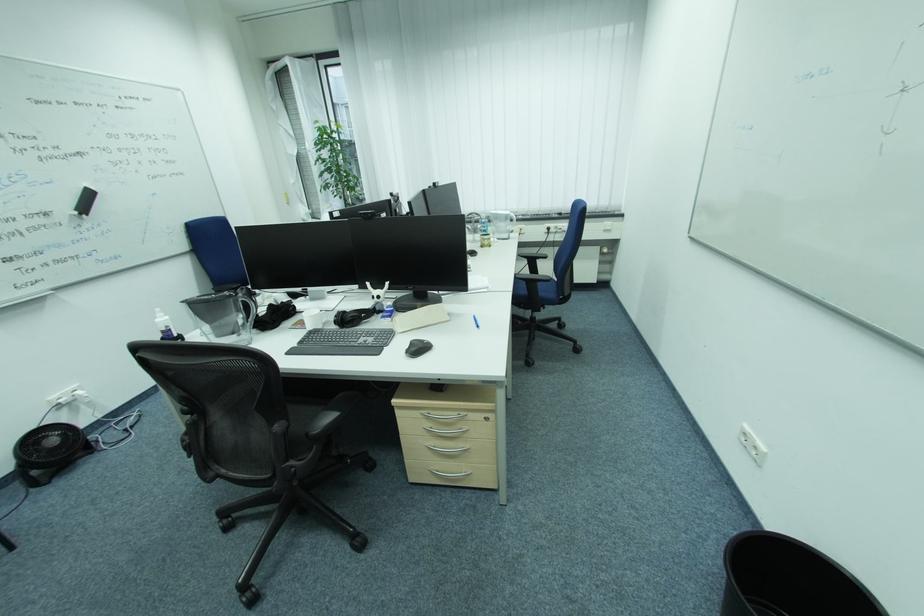
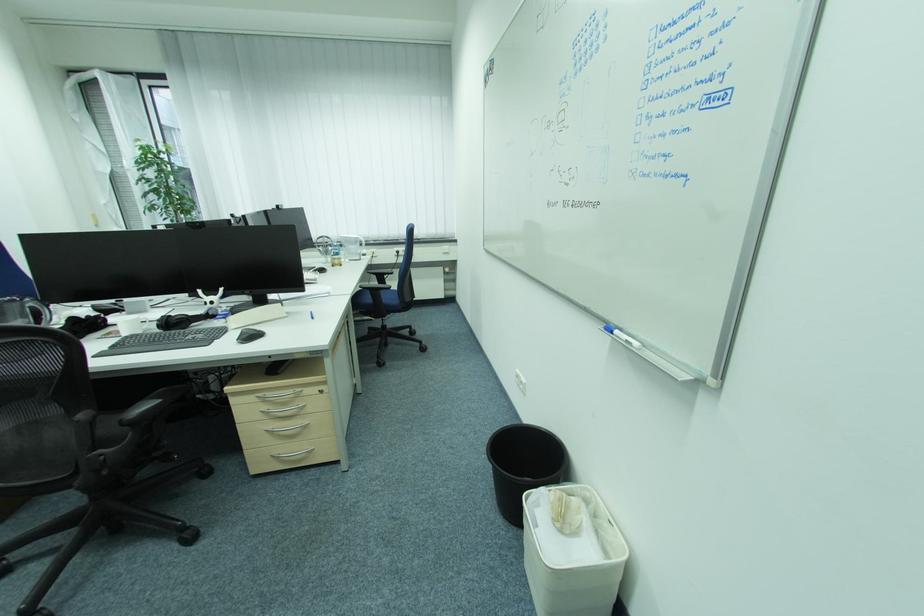
Locate, in the second image, the point that corresponds to [343,323] in the first image.

(166, 328)